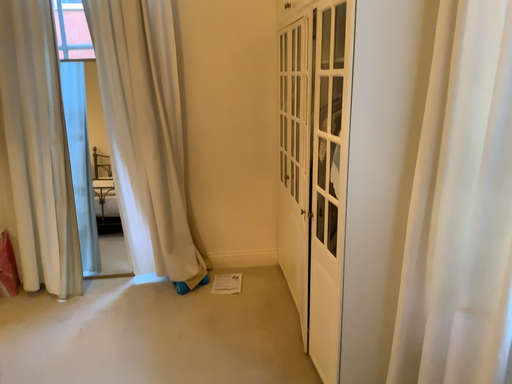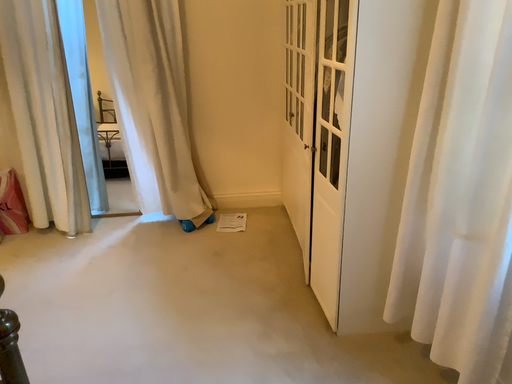
Question: How did the camera likely rotate when shooting the video?

Choices:
 (A) rotated upward
 (B) rotated downward

Answer: (B)